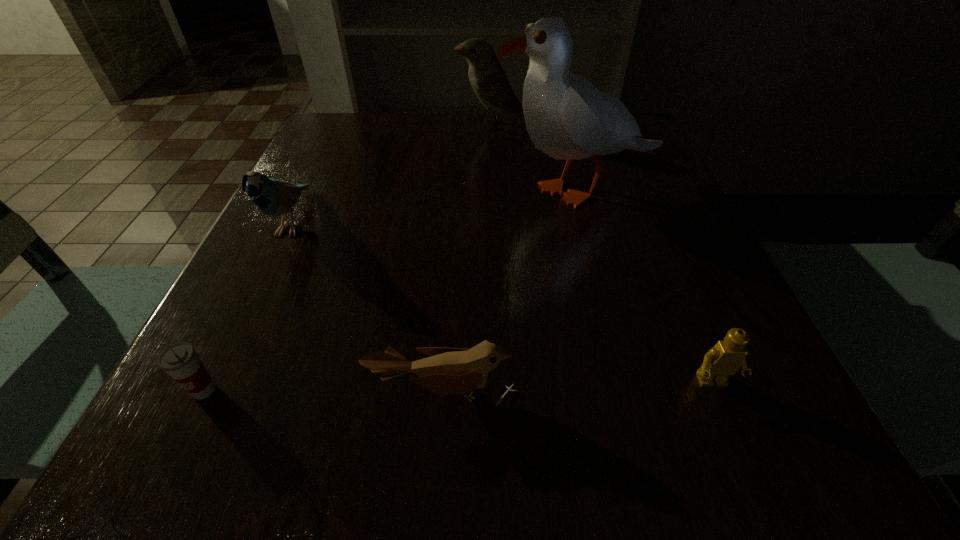
What are the coordinates of `the second closest bird to the leftmost bird` in the screenshot? It's located at (489, 81).

This screenshot has height=540, width=960. Find the location of `free spot that satisfies the following two spatial constraints: 1. at the face of the farthest bird; 2. on the side of the cup with the logo`. free spot that satisfies the following two spatial constraints: 1. at the face of the farthest bird; 2. on the side of the cup with the logo is located at coordinates (502, 390).

The height and width of the screenshot is (540, 960). In order to click on vacant region that satisfies the following two spatial constraints: 1. at the beak of the tallest object; 2. on the side of the cup with the logo in this screenshot , I will do `click(636, 390)`.

Find the location of `vacant point that satisfies the following two spatial constraints: 1. at the face of the farthest bird; 2. on the side of the cup with the logo`. vacant point that satisfies the following two spatial constraints: 1. at the face of the farthest bird; 2. on the side of the cup with the logo is located at coordinates pyautogui.click(x=502, y=390).

Identify the location of free point that satisfies the following two spatial constraints: 1. at the beak of the tallest object; 2. at the face of the second nearest bird. (588, 222).